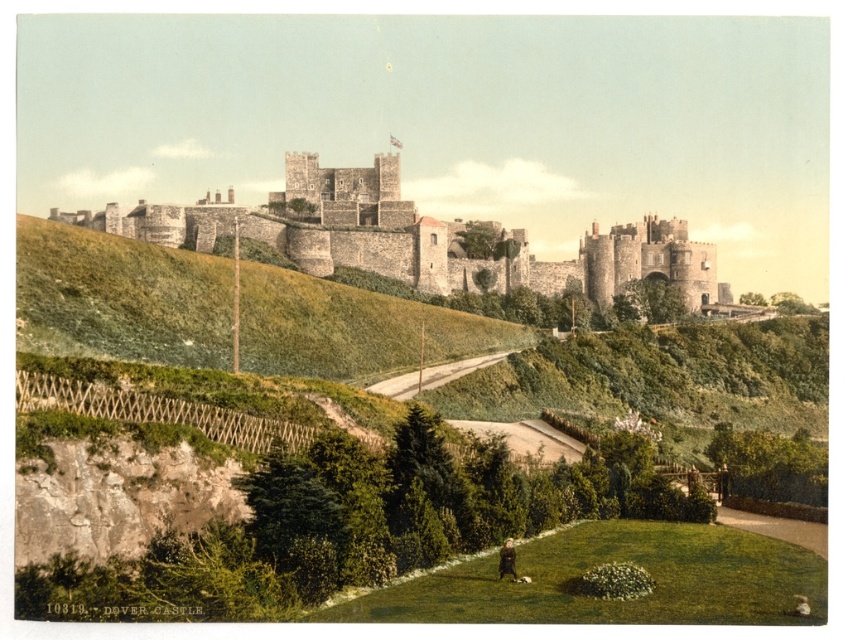
You are a visitor standing at the garden path in front of the stone castle at center. You want to take your brown fur dog at lower center with you to explore the castle grounds. Can you see the dog while walking towards the castle?

The brown fur dog at lower center is behind the stone castle at center, so you cannot see the dog while walking towards the castle.

Consider the image. You are standing at the base of the castle hill and see the green grassy hillside at upper center and the brown fur dog at lower center. Which object is higher in elevation?

The green grassy hillside at upper center is higher in elevation than the brown fur dog at lower center.